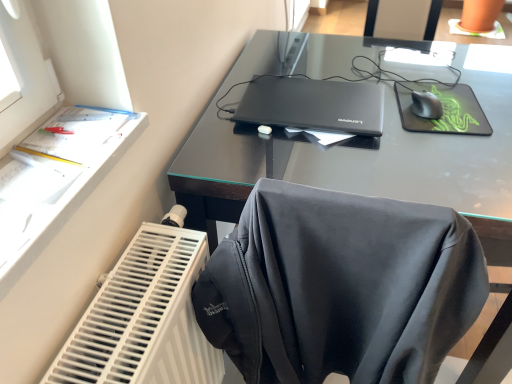
Question: Considering the positions of green matte mousepad at upper right and black matte laptop at center in the image, is green matte mousepad at upper right taller or shorter than black matte laptop at center?

Choices:
 (A) tall
 (B) short

Answer: (B)

Question: Relative to black matte laptop at center, is green matte mousepad at upper right in front or behind?

Choices:
 (A) behind
 (B) front

Answer: (A)

Question: Based on their relative distances, which object is nearer to the black glass desk at center?

Choices:
 (A) white plastic radiator at lower left
 (B) green matte mousepad at upper right
 (C) black matte laptop at center
 (D) black matte mouse at upper right

Answer: (C)

Question: Estimate the real-world distances between objects in this image. Which object is closer to the white plastic radiator at lower left?

Choices:
 (A) black matte laptop at center
 (B) black glass desk at center
 (C) green matte mousepad at upper right
 (D) black matte mouse at upper right

Answer: (B)